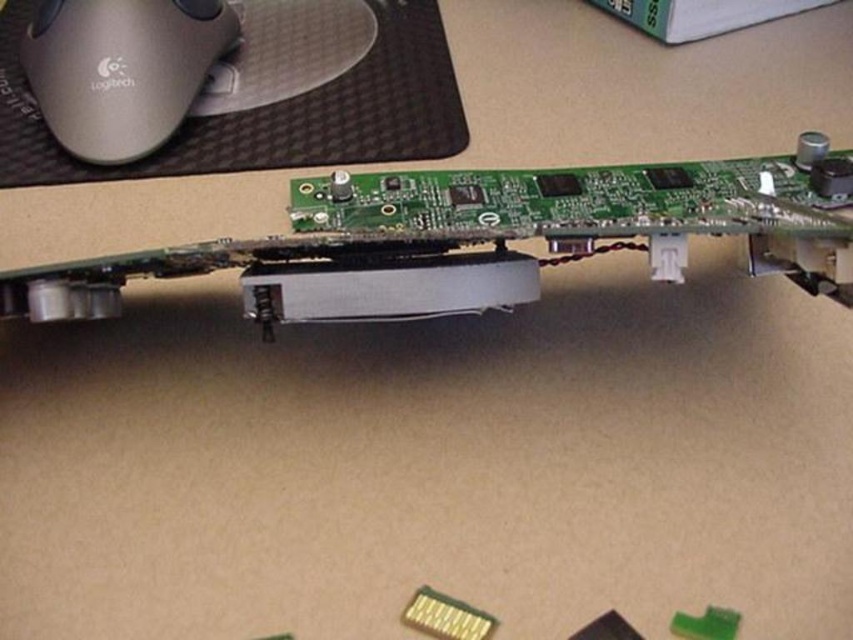
Question: Does black rubber mousepad at upper center appear on the right side of matte white mouse at upper left?

Choices:
 (A) no
 (B) yes

Answer: (B)

Question: Does black rubber mousepad at upper center appear on the right side of matte white mouse at upper left?

Choices:
 (A) no
 (B) yes

Answer: (B)

Question: Which object is farther from the camera taking this photo?

Choices:
 (A) matte white mouse at upper left
 (B) black rubber mousepad at upper center

Answer: (B)

Question: Does black rubber mousepad at upper center appear on the right side of matte white mouse at upper left?

Choices:
 (A) no
 (B) yes

Answer: (B)

Question: Which object is farther from the camera taking this photo?

Choices:
 (A) matte white mouse at upper left
 (B) black rubber mousepad at upper center

Answer: (B)